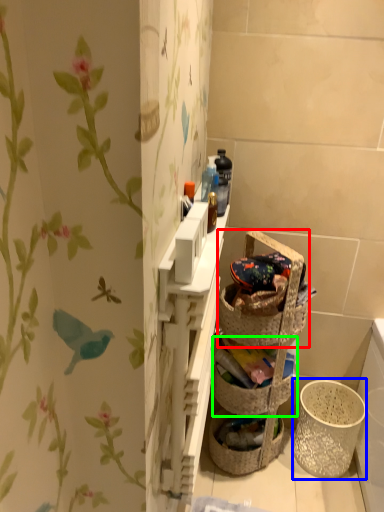
Question: Which object is positioned farthest from picnic basket (highlighted by a red box)? Select from basket container (highlighted by a blue box) and basket container (highlighted by a green box).

Choices:
 (A) basket container
 (B) basket container

Answer: (A)